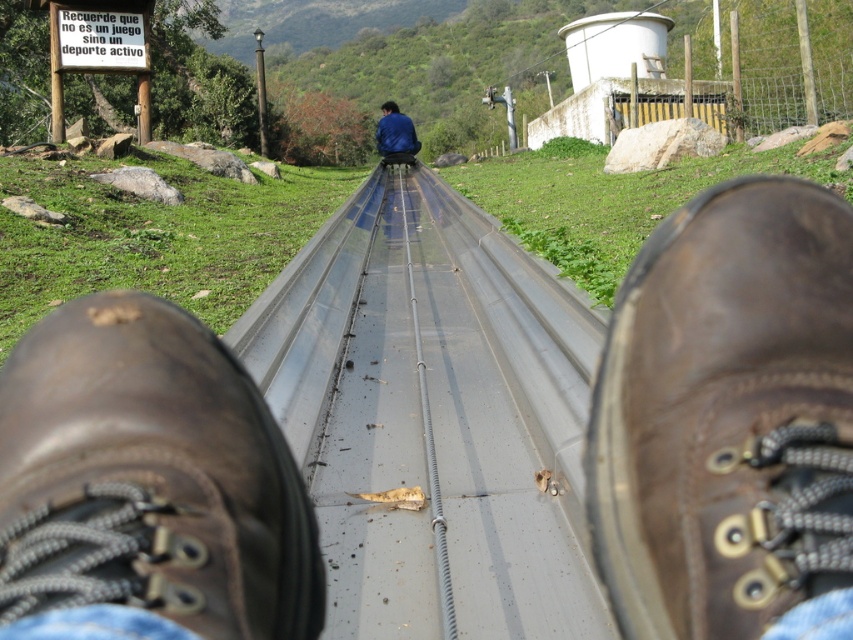
Question: Which point is closer to the camera taking this photo?

Choices:
 (A) (9, 461)
 (B) (524, 310)
 (C) (641, 468)

Answer: (A)

Question: Can you confirm if metallic smooth train track at center is thinner than blue fabric jacket at center?

Choices:
 (A) no
 (B) yes

Answer: (A)

Question: Which object is closer to the camera taking this photo?

Choices:
 (A) brown leather boot at lower center
 (B) metallic smooth train track at center
 (C) blue fabric jacket at center
 (D) brown leather boot at center

Answer: (D)

Question: Is brown leather boot at lower center wider than blue fabric jacket at center?

Choices:
 (A) no
 (B) yes

Answer: (A)

Question: Does metallic smooth train track at center appear on the right side of blue fabric jacket at center?

Choices:
 (A) no
 (B) yes

Answer: (B)

Question: Which point appears closest to the camera in this image?

Choices:
 (A) (378, 138)
 (B) (467, 376)

Answer: (B)